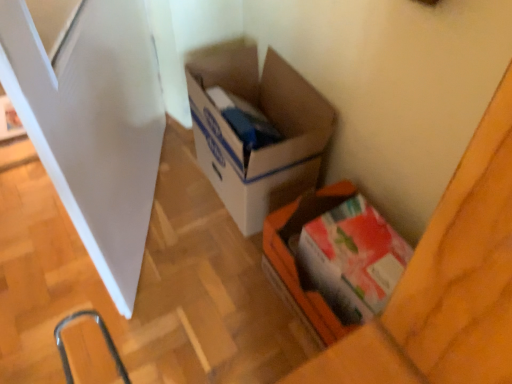
The height and width of the screenshot is (384, 512). What do you see at coordinates (333, 259) in the screenshot?
I see `matte cardboard box at lower right, which appears as the first box when viewed from the front` at bounding box center [333, 259].

At what (x,y) coordinates should I click in order to perform the action: click on white glossy screen door at left. Please return your answer as a coordinate pair (x, y). Looking at the image, I should click on (93, 125).

Is cardboard box at center, which is counted as the 1th box, starting from the back, completely or partially inside matte cardboard box at lower right, the second box from the back?

No, cardboard box at center, which is counted as the 1th box, starting from the back, is located outside of matte cardboard box at lower right, the second box from the back.

Image resolution: width=512 pixels, height=384 pixels. In the image, there is a cardboard box at center, which is counted as the 1th box, starting from the back. Identify the location of box below it (from the image's perspective). (333, 259).

Is matte cardboard box at lower right, which appears as the first box when viewed from the front, not close to cardboard box at center, which is counted as the second box, starting from the front?

They are positioned close to each other.

From a real-world perspective, is cardboard box at center, which is counted as the 1th box, starting from the back, positioned over white glossy screen door at left based on gravity?

No.

You are a GUI agent. You are given a task and a screenshot of the screen. Output one action in this format:
    pyautogui.click(x=<x>, y=<y>)
    Task: Click on the 1st box to the right of the white glossy screen door at left, counting from the anchor's position
    Image resolution: width=512 pixels, height=384 pixels.
    Given the screenshot: What is the action you would take?
    pyautogui.click(x=261, y=148)

From the image's perspective, which object appears higher, cardboard box at center, which is counted as the second box, starting from the front, or white glossy screen door at left?

From the image's view, white glossy screen door at left is above.

Is cardboard box at center, which is counted as the second box, starting from the front, oriented away from white glossy screen door at left?

No, cardboard box at center, which is counted as the second box, starting from the front, is not facing away from white glossy screen door at left.

Is point (18, 37) closer to camera compared to point (302, 195)?

Yes.

Which of these two, white glossy screen door at left or matte cardboard box at lower right, the second box from the back, is thinner?

With smaller width is white glossy screen door at left.

Considering the sizes of objects white glossy screen door at left and matte cardboard box at lower right, the second box from the back, in the image provided, who is taller, white glossy screen door at left or matte cardboard box at lower right, the second box from the back,?

white glossy screen door at left.

Can we say white glossy screen door at left lies outside matte cardboard box at lower right, the second box from the back?

white glossy screen door at left is positioned outside matte cardboard box at lower right, the second box from the back.

Which is farther, [254,63] or [296,239]?

The point [254,63] is farther from the camera.

Is cardboard box at center, which is counted as the second box, starting from the front, taller than matte cardboard box at lower right, which appears as the first box when viewed from the front?

Indeed, cardboard box at center, which is counted as the second box, starting from the front, has a greater height compared to matte cardboard box at lower right, which appears as the first box when viewed from the front.

From the image's perspective, which is below, cardboard box at center, which is counted as the 1th box, starting from the back, or matte cardboard box at lower right, which appears as the first box when viewed from the front?

matte cardboard box at lower right, which appears as the first box when viewed from the front, appears lower in the image.

From a real-world perspective, between cardboard box at center, which is counted as the 1th box, starting from the back, and matte cardboard box at lower right, which appears as the first box when viewed from the front, who is vertically lower?

From a 3D spatial view, cardboard box at center, which is counted as the 1th box, starting from the back, is below.

At what (x,y) coordinates should I click in order to perform the action: click on the 1st box to the right when counting from the white glossy screen door at left. Please return your answer as a coordinate pair (x, y). Looking at the image, I should click on (261, 148).

Is the position of white glossy screen door at left less distant than that of cardboard box at center, which is counted as the 1th box, starting from the back?

That is True.

Considering the positions of objects white glossy screen door at left and cardboard box at center, which is counted as the 1th box, starting from the back, in the image provided, who is more to the right, white glossy screen door at left or cardboard box at center, which is counted as the 1th box, starting from the back,?

Positioned to the right is cardboard box at center, which is counted as the 1th box, starting from the back.

Does matte cardboard box at lower right, the second box from the back, lie behind white glossy screen door at left?

That is True.

From the image's perspective, between matte cardboard box at lower right, the second box from the back, and white glossy screen door at left, which one is located above?

white glossy screen door at left appears higher in the image.

Looking at the image, does matte cardboard box at lower right, the second box from the back, seem bigger or smaller compared to white glossy screen door at left?

In the image, matte cardboard box at lower right, the second box from the back, appears to be smaller than white glossy screen door at left.

From the picture: From a real-world perspective, between matte cardboard box at lower right, which appears as the first box when viewed from the front, and white glossy screen door at left, who is vertically higher?

white glossy screen door at left is physically above.

The width and height of the screenshot is (512, 384). Find the location of `box that appears above the cardboard box at center, which is counted as the second box, starting from the front (from a real-world perspective)`. box that appears above the cardboard box at center, which is counted as the second box, starting from the front (from a real-world perspective) is located at coordinates (333, 259).

Find the location of a particular element. The image size is (512, 384). box that is the 1st one when counting rightward from the white glossy screen door at left is located at coordinates (261, 148).

Consider the image. Based on their spatial positions, is white glossy screen door at left or matte cardboard box at lower right, which appears as the first box when viewed from the front, closer to cardboard box at center, which is counted as the 1th box, starting from the back?

matte cardboard box at lower right, which appears as the first box when viewed from the front.

Estimate the real-world distances between objects in this image. Which object is closer to cardboard box at center, which is counted as the 1th box, starting from the back, matte cardboard box at lower right, which appears as the first box when viewed from the front, or white glossy screen door at left?

matte cardboard box at lower right, which appears as the first box when viewed from the front, lies closer to cardboard box at center, which is counted as the 1th box, starting from the back, than the other object.

When comparing their distances from white glossy screen door at left, does cardboard box at center, which is counted as the second box, starting from the front, or matte cardboard box at lower right, which appears as the first box when viewed from the front, seem closer?

cardboard box at center, which is counted as the second box, starting from the front, is positioned closer to the anchor white glossy screen door at left.

Estimate the real-world distances between objects in this image. Which object is further from matte cardboard box at lower right, the second box from the back, white glossy screen door at left or cardboard box at center, which is counted as the second box, starting from the front?

white glossy screen door at left is positioned further to the anchor matte cardboard box at lower right, the second box from the back.

Estimate the real-world distances between objects in this image. Which object is further from matte cardboard box at lower right, the second box from the back, cardboard box at center, which is counted as the second box, starting from the front, or white glossy screen door at left?

white glossy screen door at left is further to matte cardboard box at lower right, the second box from the back.

Consider the image. Based on their spatial positions, is matte cardboard box at lower right, which appears as the first box when viewed from the front, or cardboard box at center, which is counted as the 1th box, starting from the back, further from white glossy screen door at left?

Based on the image, matte cardboard box at lower right, which appears as the first box when viewed from the front, appears to be further to white glossy screen door at left.

Find the location of a particular element. This screenshot has width=512, height=384. box between white glossy screen door at left and matte cardboard box at lower right, the second box from the back, from left to right is located at coordinates (261, 148).